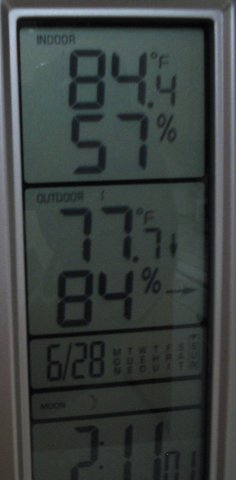
Where is `border of thermostat`? The width and height of the screenshot is (236, 480). border of thermostat is located at coordinates (22, 408).